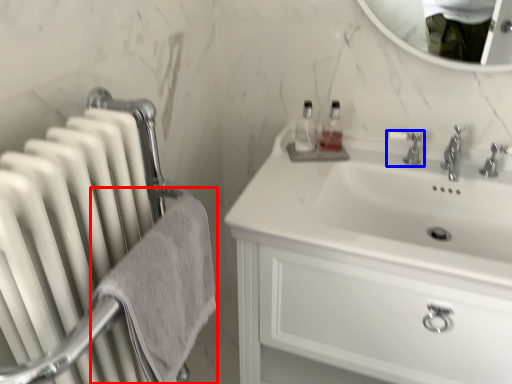
Question: Which object is further to the camera taking this photo, bath towel (highlighted by a red box) or tap (highlighted by a blue box)?

Choices:
 (A) bath towel
 (B) tap

Answer: (B)